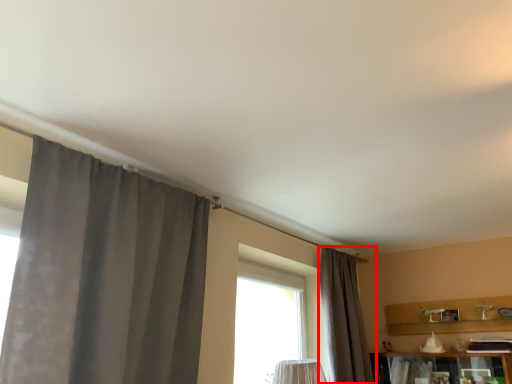
Question: From the image's perspective, what is the correct spatial positioning of curtain (annotated by the red box) in reference to curtain?

Choices:
 (A) above
 (B) below

Answer: (B)